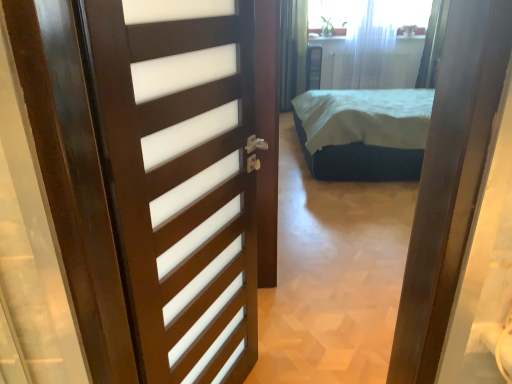
Question: Considering the relative sizes of dark green fabric bed at center and dark wood door at left in the image provided, is dark green fabric bed at center bigger than dark wood door at left?

Choices:
 (A) yes
 (B) no

Answer: (A)

Question: Can you confirm if dark green fabric bed at center is positioned to the right of dark wood door at left?

Choices:
 (A) no
 (B) yes

Answer: (B)

Question: Is dark green fabric bed at center positioned before dark wood door at left?

Choices:
 (A) no
 (B) yes

Answer: (A)

Question: From the image's perspective, would you say dark green fabric bed at center is shown under dark wood door at left?

Choices:
 (A) yes
 (B) no

Answer: (B)

Question: Is dark wood door at left surrounded by dark green fabric bed at center?

Choices:
 (A) yes
 (B) no

Answer: (B)

Question: Is dark green fabric bed at center positioned behind dark wood door at left?

Choices:
 (A) yes
 (B) no

Answer: (A)

Question: Is dark green fabric bed at center facing towards white sheer curtain at upper center?

Choices:
 (A) no
 (B) yes

Answer: (A)

Question: From a real-world perspective, is dark green fabric bed at center located beneath white sheer curtain at upper center?

Choices:
 (A) no
 (B) yes

Answer: (B)

Question: From the image's perspective, is dark green fabric bed at center on top of white sheer curtain at upper center?

Choices:
 (A) yes
 (B) no

Answer: (B)

Question: Is white sheer curtain at upper center surrounded by dark green fabric bed at center?

Choices:
 (A) no
 (B) yes

Answer: (A)

Question: Is dark green fabric bed at center taller than white sheer curtain at upper center?

Choices:
 (A) no
 (B) yes

Answer: (A)

Question: Does dark green fabric bed at center have a greater width compared to white sheer curtain at upper center?

Choices:
 (A) no
 (B) yes

Answer: (B)

Question: Does white sheer curtain at upper center appear on the right side of dark green fabric bed at center?

Choices:
 (A) yes
 (B) no

Answer: (A)